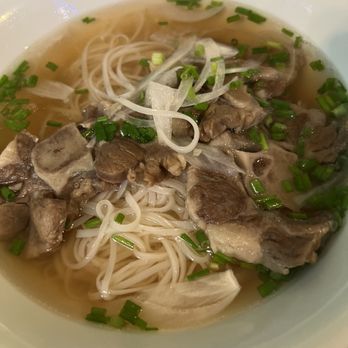
I want to click on white plate, so click(19, 22), click(18, 314), click(316, 300), click(325, 14).